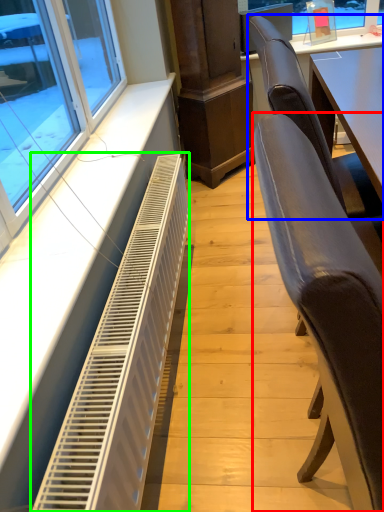
Question: Estimate the real-world distances between objects in this image. Which object is closer to chair (highlighted by a red box), chair (highlighted by a blue box) or air conditioning (highlighted by a green box)?

Choices:
 (A) chair
 (B) air conditioning

Answer: (A)